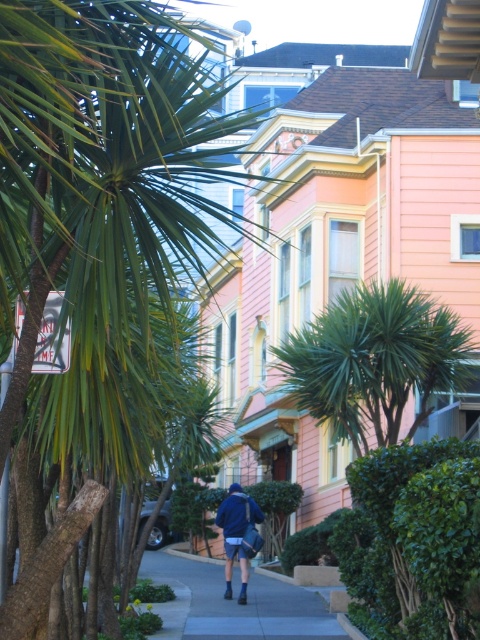
You are standing on the sidewalk in the urban street scene and notice the green leafy palm tree at center and the blue fabric jacket at center. Which object is taller?

The green leafy palm tree at center is taller than the blue fabric jacket at center.

You are standing on the sidewalk and want to take a photo of the blue fabric jacket at center without the green leafy palm tree at center blocking the view. Is the palm tree currently in front of or behind the jacket?

The green leafy palm tree at center is in front of the blue fabric jacket at center, so it is blocking the view. To take a photo without the palm tree blocking, you would need to move to a position where the jacket is between you and the palm tree.